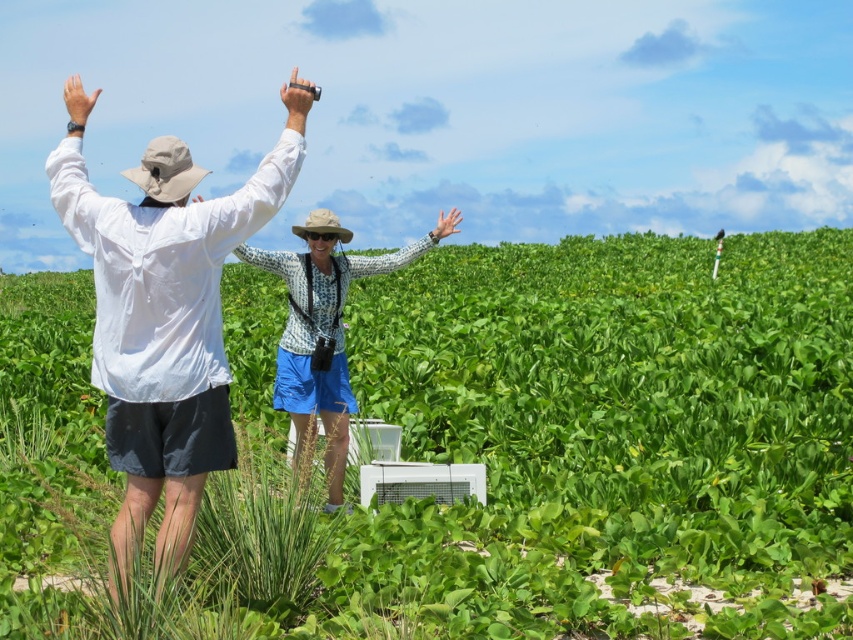
Who is more distant from viewer, (409, 256) or (448, 234)?

Point (448, 234)

Between patterned fabric shirt at center and matte white hand at center, which one has less height?

matte white hand at center

What do you see at coordinates (320, 332) in the screenshot? The height and width of the screenshot is (640, 853). I see `patterned fabric shirt at center` at bounding box center [320, 332].

Identify the location of patterned fabric shirt at center. The image size is (853, 640). pos(320,332).

Is white matte shirt at left above matte white hand at upper left?

Incorrect, white matte shirt at left is not positioned above matte white hand at upper left.

Who is positioned more to the right, white matte shirt at left or matte white hand at upper left?

From the viewer's perspective, white matte shirt at left appears more on the right side.

I want to click on white matte shirt at left, so click(x=163, y=324).

Does matte black flashlight at upper center lie in front of matte white hand at upper left?

Yes, it is.

The width and height of the screenshot is (853, 640). What do you see at coordinates (296, 99) in the screenshot? I see `matte black flashlight at upper center` at bounding box center [296, 99].

Measure the distance between matte black flashlight at upper center and camera.

5.28 meters

You are a GUI agent. You are given a task and a screenshot of the screen. Output one action in this format:
    pyautogui.click(x=<x>, y=<y>)
    Task: Click on the matte black flashlight at upper center
    The height and width of the screenshot is (640, 853).
    Given the screenshot: What is the action you would take?
    pyautogui.click(x=296, y=99)